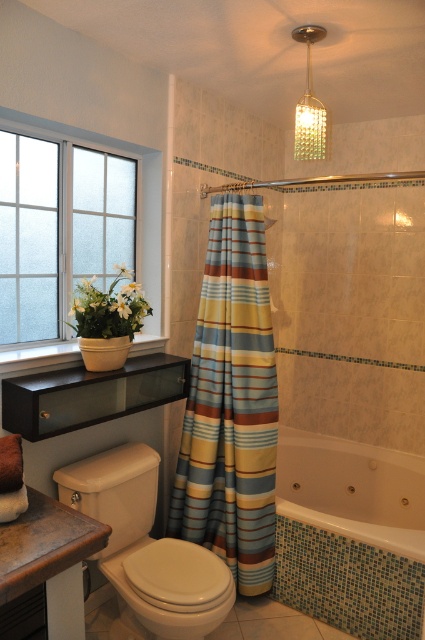
What are the coordinates of the striped fabric shower curtain at center?

The striped fabric shower curtain at center is located at coordinates point (231, 403).